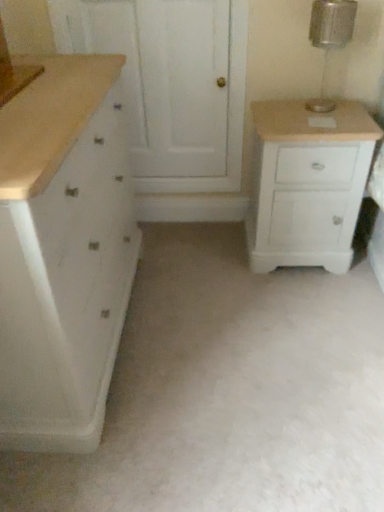
Question: From the image's perspective, does white wood screen door at upper center appear lower than white matte chest of drawers at left, which is the first chest of drawers from left to right?

Choices:
 (A) no
 (B) yes

Answer: (A)

Question: Is white wood screen door at upper center touching white matte chest of drawers at left, which is the first chest of drawers from left to right?

Choices:
 (A) no
 (B) yes

Answer: (A)

Question: Is white wood screen door at upper center closer to the viewer compared to white matte chest of drawers at left, which is the first chest of drawers from left to right?

Choices:
 (A) yes
 (B) no

Answer: (B)

Question: From a real-world perspective, is white wood screen door at upper center positioned over white matte chest of drawers at left, which is the first chest of drawers from left to right, based on gravity?

Choices:
 (A) no
 (B) yes

Answer: (B)

Question: Is white wood screen door at upper center bigger than white matte chest of drawers at left, the 2th chest of drawers when ordered from right to left?

Choices:
 (A) no
 (B) yes

Answer: (A)

Question: Is point (319, 99) closer or farther from the camera than point (107, 307)?

Choices:
 (A) farther
 (B) closer

Answer: (A)

Question: Looking at the image, does metallic glass lamp at upper right seem bigger or smaller compared to white matte chest of drawers at left, which is the first chest of drawers from left to right?

Choices:
 (A) small
 (B) big

Answer: (A)

Question: In terms of height, does metallic glass lamp at upper right look taller or shorter compared to white matte chest of drawers at left, the 2th chest of drawers when ordered from right to left?

Choices:
 (A) tall
 (B) short

Answer: (B)

Question: From a real-world perspective, relative to white matte chest of drawers at left, the 2th chest of drawers when ordered from right to left, is metallic glass lamp at upper right vertically above or below?

Choices:
 (A) above
 (B) below

Answer: (A)

Question: Based on their positions, is white wood screen door at upper center located to the left or right of white matte chest of drawers at left, which is the first chest of drawers from left to right?

Choices:
 (A) right
 (B) left

Answer: (A)

Question: Based on their sizes in the image, would you say white wood screen door at upper center is bigger or smaller than white matte chest of drawers at left, the 2th chest of drawers when ordered from right to left?

Choices:
 (A) small
 (B) big

Answer: (A)

Question: In terms of height, does white wood screen door at upper center look taller or shorter compared to white matte chest of drawers at left, which is the first chest of drawers from left to right?

Choices:
 (A) short
 (B) tall

Answer: (A)

Question: From a real-world perspective, is white wood screen door at upper center above or below white matte chest of drawers at left, which is the first chest of drawers from left to right?

Choices:
 (A) above
 (B) below

Answer: (A)

Question: Do you think white painted wood cabinet at right, which is the first chest of drawers in right-to-left order, is within white matte chest of drawers at left, the 2th chest of drawers when ordered from right to left, or outside of it?

Choices:
 (A) outside
 (B) inside

Answer: (A)

Question: Based on their sizes in the image, would you say white painted wood cabinet at right, the 2th chest of drawers positioned from the left, is bigger or smaller than white matte chest of drawers at left, the 2th chest of drawers when ordered from right to left?

Choices:
 (A) big
 (B) small

Answer: (B)